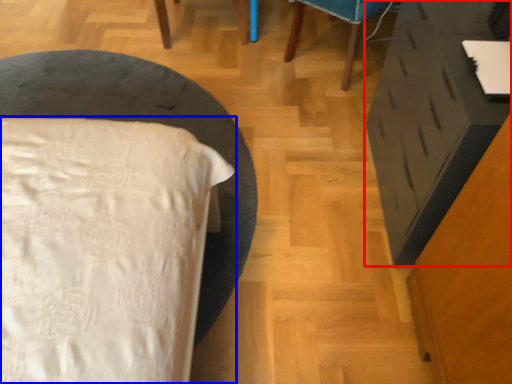
Question: Which object is closer to the camera taking this photo, vanity (highlighted by a red box) or bed (highlighted by a blue box)?

Choices:
 (A) vanity
 (B) bed

Answer: (A)